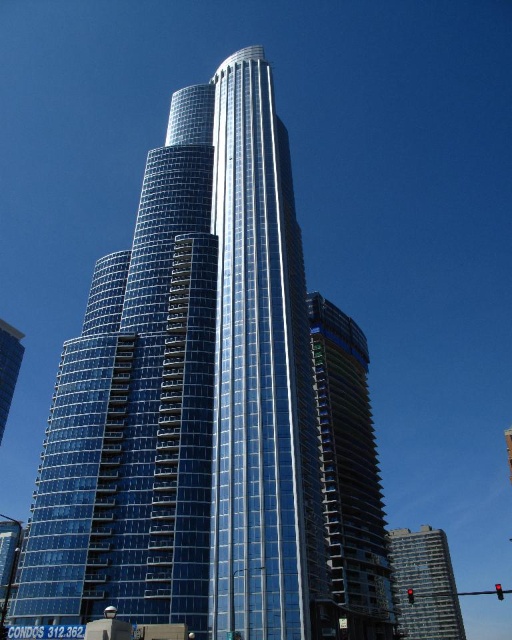
Question: Is transparent glass building at center bigger than clear glass building at lower right?

Choices:
 (A) yes
 (B) no

Answer: (B)

Question: Which of the following is the closest to the observer?

Choices:
 (A) clear glass building at lower right
 (B) transparent glass building at center

Answer: (B)

Question: Which of the following is the farthest from the observer?

Choices:
 (A) transparent glass building at center
 (B) clear glass building at lower right

Answer: (B)

Question: Does transparent glass building at center have a greater width compared to clear glass building at lower right?

Choices:
 (A) yes
 (B) no

Answer: (A)

Question: Does transparent glass building at center come in front of clear glass building at lower right?

Choices:
 (A) yes
 (B) no

Answer: (A)

Question: Which object appears farthest from the camera in this image?

Choices:
 (A) transparent glass building at center
 (B) clear glass building at lower right

Answer: (B)